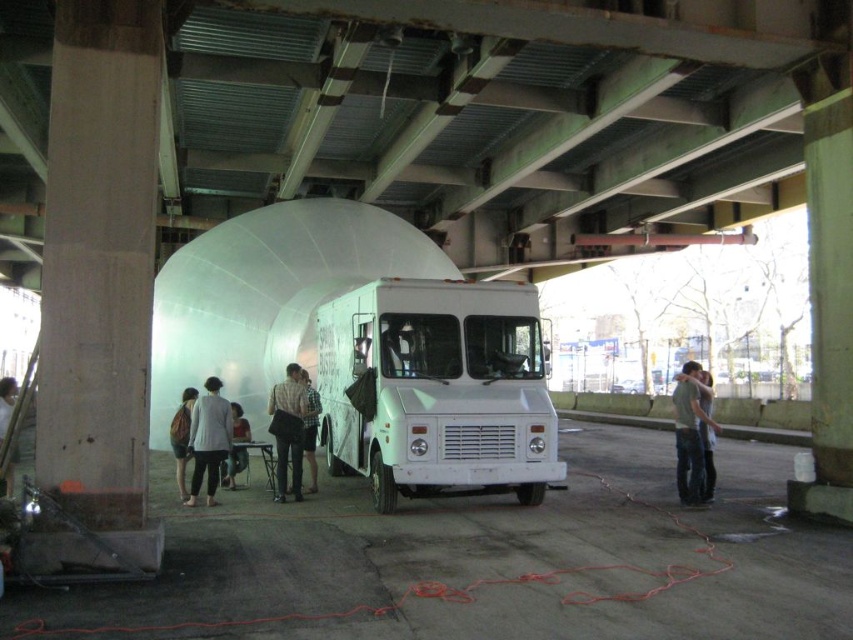
Is light gray fabric jacket at lower left positioned behind denim shorts at lower left?

No, it is in front of denim shorts at lower left.

Who is taller, light gray fabric jacket at lower left or denim shorts at lower left?

Standing taller between the two is light gray fabric jacket at lower left.

Measure the distance between point (225, 403) and camera.

A distance of 10.59 meters exists between point (225, 403) and camera.

The width and height of the screenshot is (853, 640). What are the coordinates of `light gray fabric jacket at lower left` in the screenshot? It's located at (207, 438).

Between white matte food truck at center and denim shorts at lower left, which one has more height?

white matte food truck at center is taller.

Who is positioned more to the left, white matte food truck at center or denim shorts at lower left?

denim shorts at lower left

What are the coordinates of `white matte food truck at center` in the screenshot? It's located at (437, 388).

Does denim shorts at lower left have a smaller size compared to light brown leather jacket at center?

Yes.

Which is behind, point (177, 438) or point (311, 419)?

Point (311, 419)

I want to click on denim shorts at lower left, so click(181, 436).